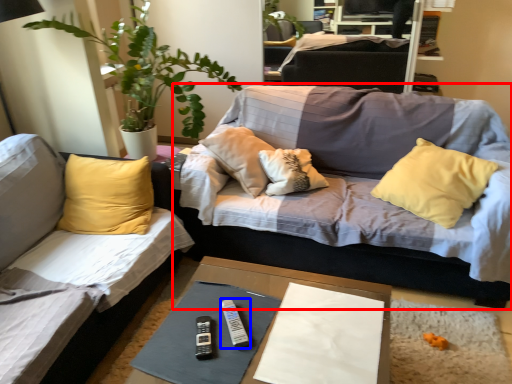
Question: Which object is further to the camera taking this photo, studio couch (highlighted by a red box) or remote (highlighted by a blue box)?

Choices:
 (A) studio couch
 (B) remote

Answer: (A)